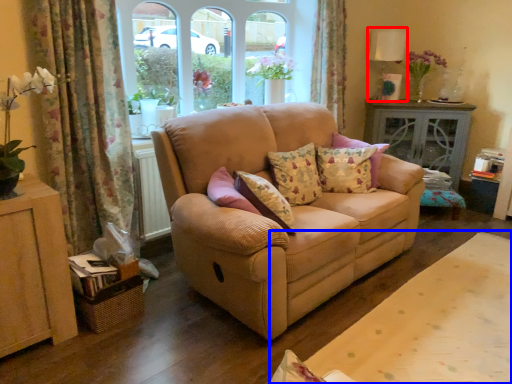
Question: Which object is closer to the camera taking this photo, lamp (highlighted by a red box) or plain (highlighted by a blue box)?

Choices:
 (A) lamp
 (B) plain

Answer: (B)